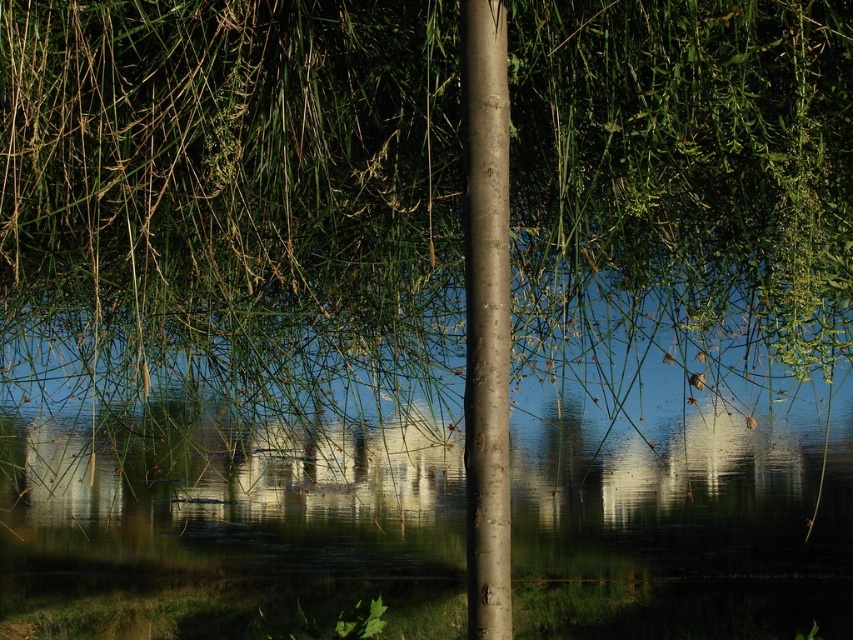
Question: Can you confirm if clear water at center is positioned to the left of smooth brown pole at center?

Choices:
 (A) yes
 (B) no

Answer: (A)

Question: Is clear water at center below smooth brown pole at center?

Choices:
 (A) no
 (B) yes

Answer: (B)

Question: Which object is farther from the camera taking this photo?

Choices:
 (A) smooth brown pole at center
 (B) clear water at center

Answer: (B)

Question: Which object appears closest to the camera in this image?

Choices:
 (A) smooth brown pole at center
 (B) clear water at center

Answer: (A)

Question: In this image, where is clear water at center located relative to smooth brown pole at center?

Choices:
 (A) left
 (B) right

Answer: (A)